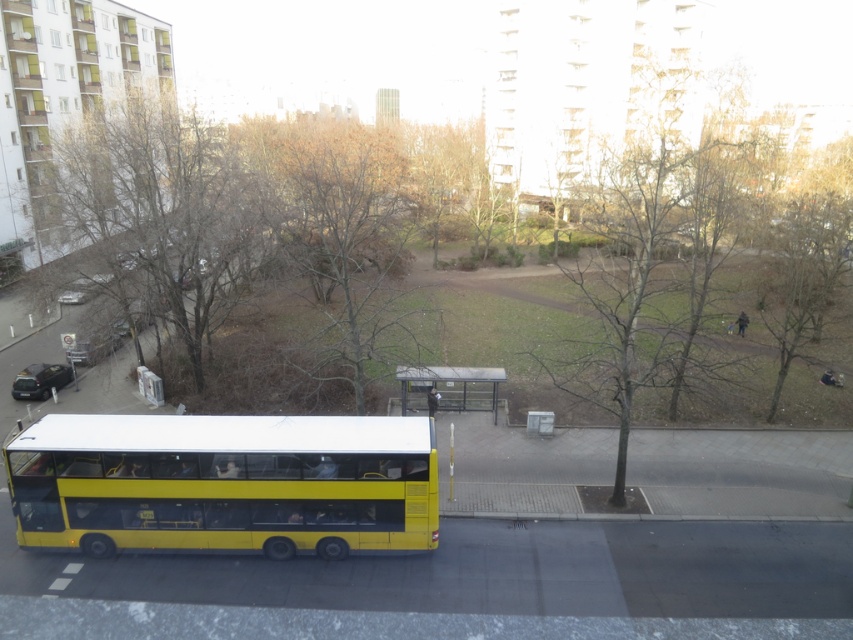
You are standing at the bus stop where the double decker bus is parked. You want to walk to the bare branches at center. Which direction should you walk from the bus stop?

The bare branches at center are located at coordinates point (653, 228), so you should walk towards the middle ground from the bus stop.

You are standing at the bus stop shelter and want to board the yellow matte bus at lower left. Based on its position, is the bus positioned to your left or right side?

The yellow matte bus at lower left is located at point (225,483), which means it is positioned to your left side.